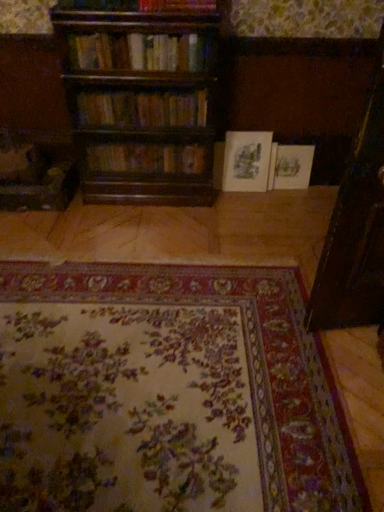
Locate an element on the screen. The height and width of the screenshot is (512, 384). free space above wooden bookshelf at center, which appears as the third book when viewed from the front (from a real-world perspective) is located at coordinates (154, 141).